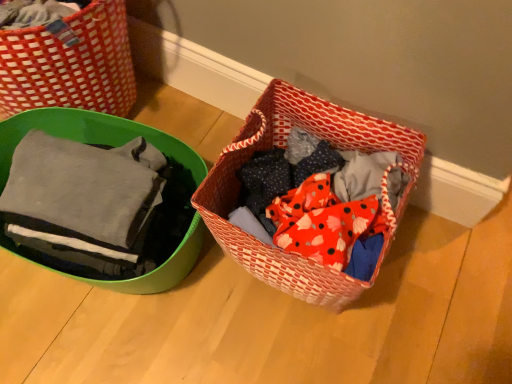
Where is `vacant area on top of matte gray fabric at left (from a real-world perspective)`? vacant area on top of matte gray fabric at left (from a real-world perspective) is located at coordinates (84, 170).